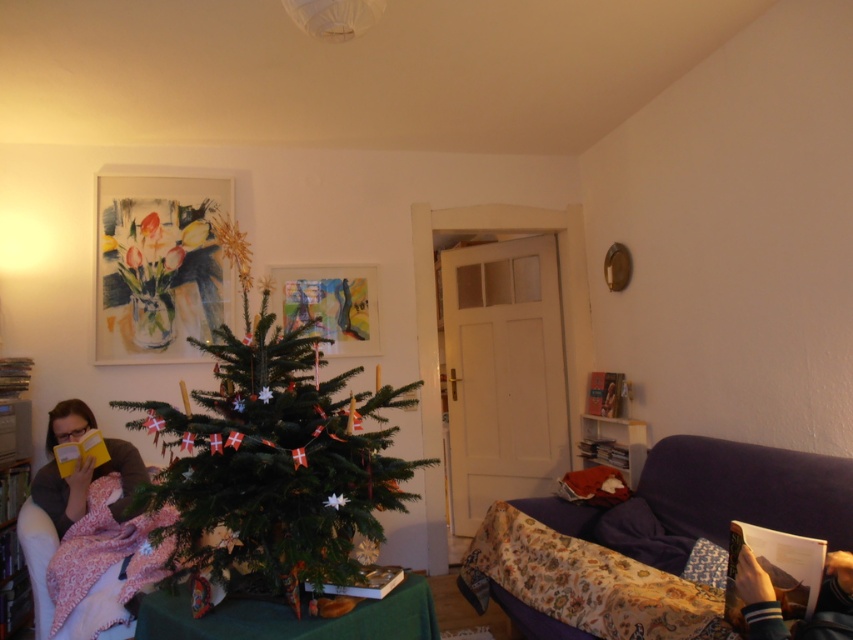
You are standing in the living room and want to hang a new picture between the two existing points marked as point (682, 472) and point (126, 490). Which point is closer to you so you can position the new picture appropriately?

Point (682, 472) is closer to the viewer than point (126, 490), so you should position the new picture closer to point (682, 472) to maintain the desired spacing.

You are a guest in the living room and want to hand a gift to the person sitting on the chair with the pink blanket. The gift is placed on the green matte christmas tree at center. To reach the gift, should you move towards the left or right relative to the matte yellow book at left?

The green matte christmas tree at center is to the right of the matte yellow book at left, so you should move towards the right relative to the matte yellow book at left to reach the gift.